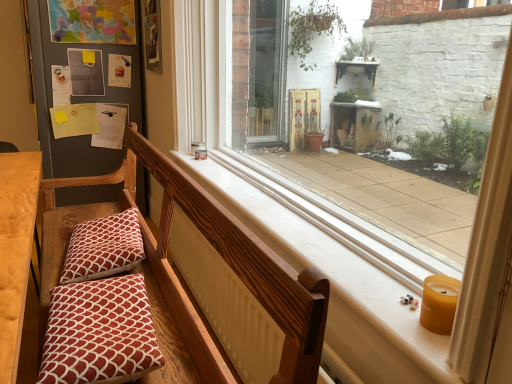
Locate an element on the screen. This screenshot has width=512, height=384. free space behind yellow wax candle at lower right is located at coordinates click(x=381, y=281).